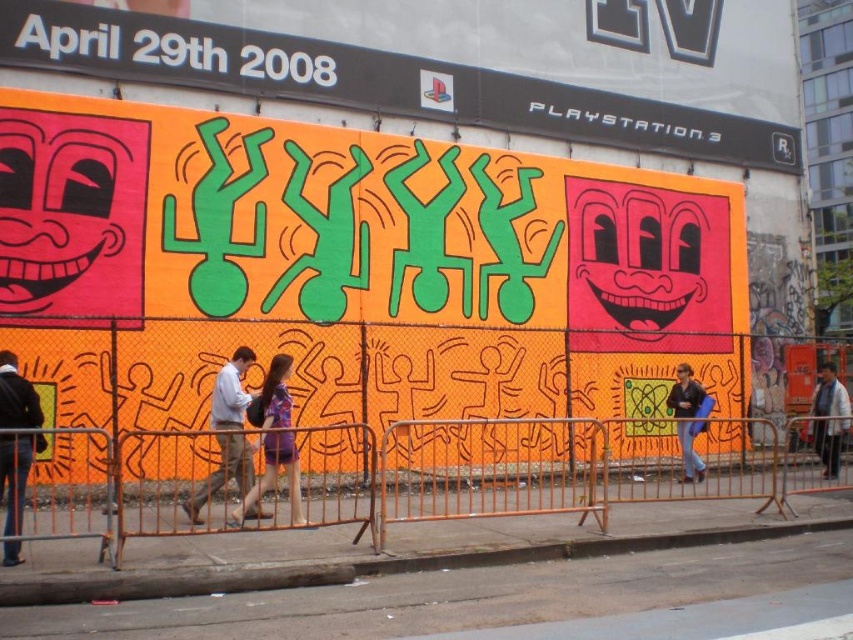
You are a pedestrian passing by the mural and notice the blue denim jacket at lower right and the matte black jacket at center. Which jacket is positioned lower in the image?

The blue denim jacket at lower right is positioned lower than the matte black jacket at center.

Consider the image. You are standing in front of the mural and want to take a photo of the orange matte wall art at center and the blue denim jacket at lower right. Which object should you focus on first to ensure both are in the frame?

You should focus on the orange matte wall art at center first because it is closer to the viewer than the blue denim jacket at lower right, so adjusting the focus to the closer object will help both be in the frame.

You are a delivery person carrying a package that requires a 6.5 foot clearance to maneuver safely. You need to navigate between the blue denim jacket at lower right and the matte black jacket at center. Can you safely pass through the space between them?

The blue denim jacket at lower right and matte black jacket at center are 7.14 feet apart, so yes, the delivery person can safely pass through the space between them since the distance is greater than the required 6.5 foot clearance.